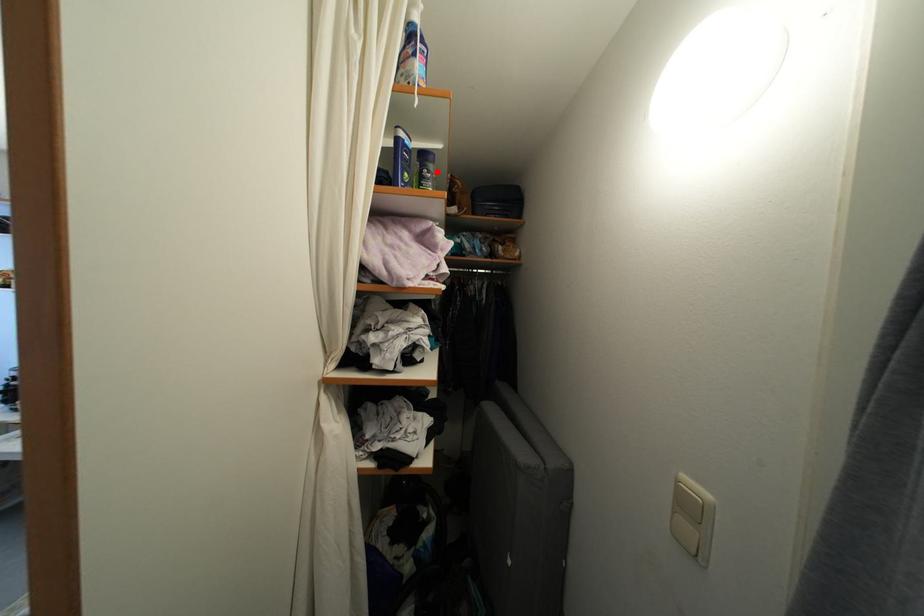
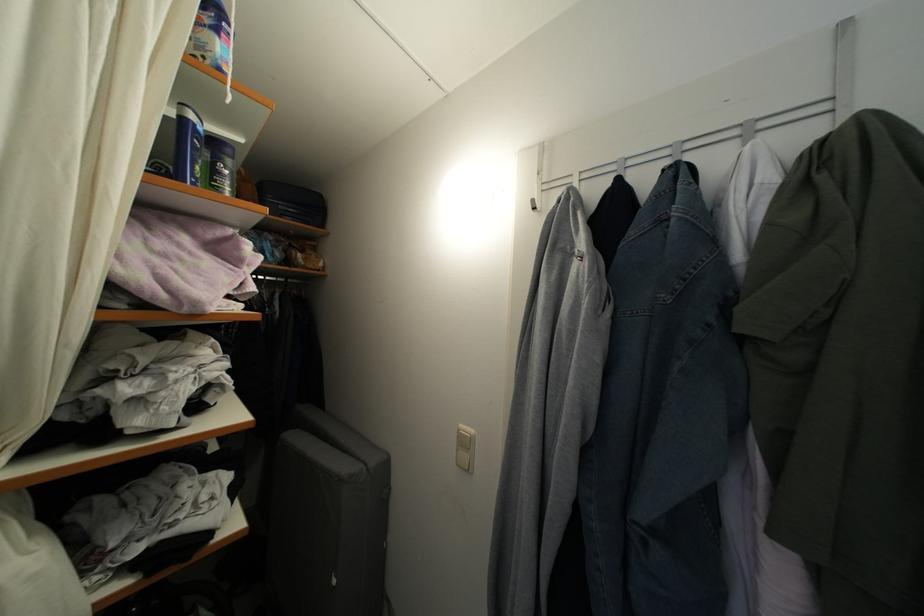
Question: I am providing you with two images of the same scene from different viewpoints. In image1, a red point is highlighted. Considering the same 3D point in image2, which of the following is correct?

Choices:
 (A) It is closer
 (B) It is farther

Answer: (B)